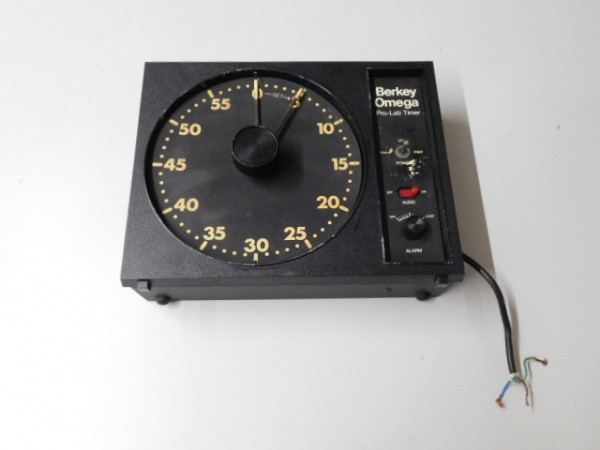
Identify the location of cord. (509, 353).